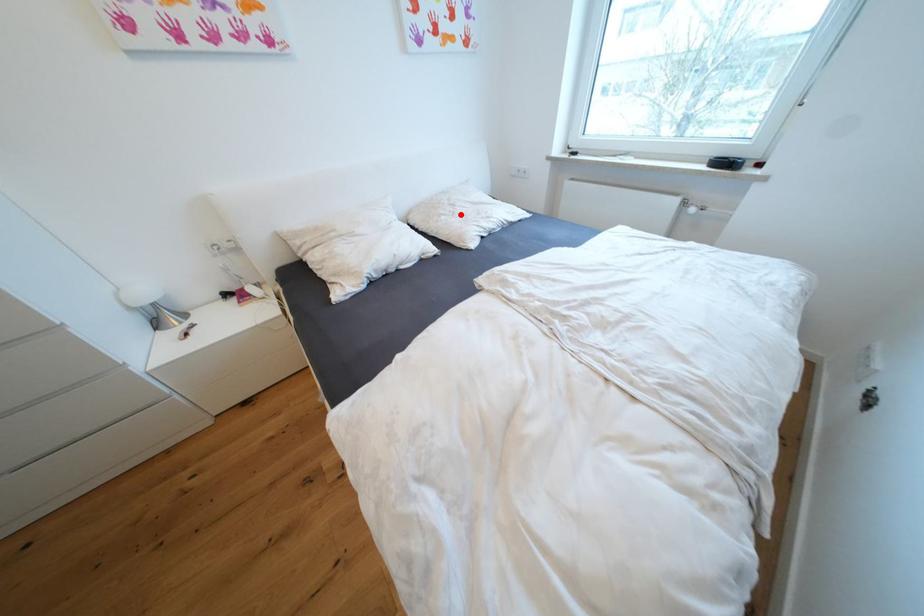
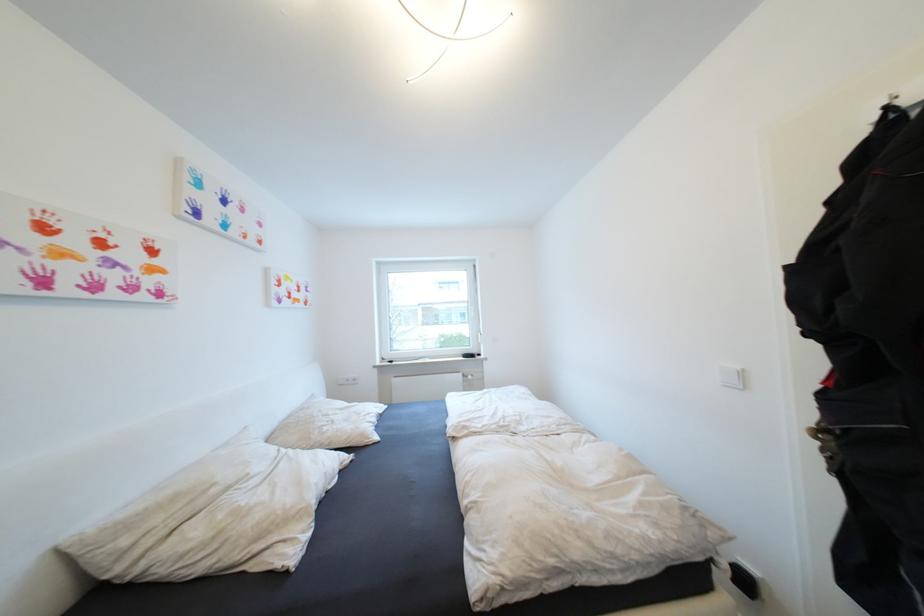
Question: I am providing you with two images of the same scene from different viewpoints. Given a red point in image1, look at the same physical point in image2. Is it:

Choices:
 (A) Closer to the viewpoint
 (B) Farther from the viewpoint

Answer: (B)